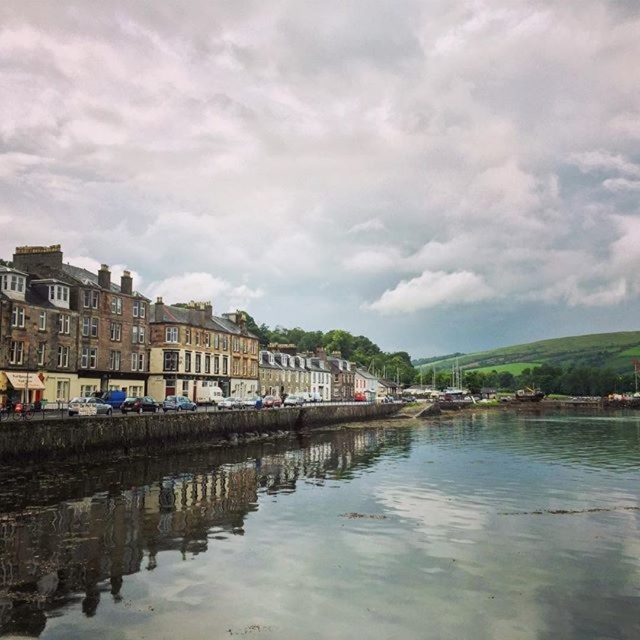
In the scene shown: You are a boat operator who needs to navigate a 3 meter wide boat through the river. The boat must pass between the clear water at center and the silver metallic car at center. Can the boat safely pass through the space between them?

The clear water at center might be wider than silver metallic car at center, so there is a possibility that the space between them is sufficient for the 3 meter wide boat to pass safely. However, the exact width is uncertain based on the provided information.

You are standing at the point marked as point (x=163, y=342) in the image. What structure is directly in front of you?

The structure directly in front of you at point (x=163, y=342) is the matte stone buildings at center.